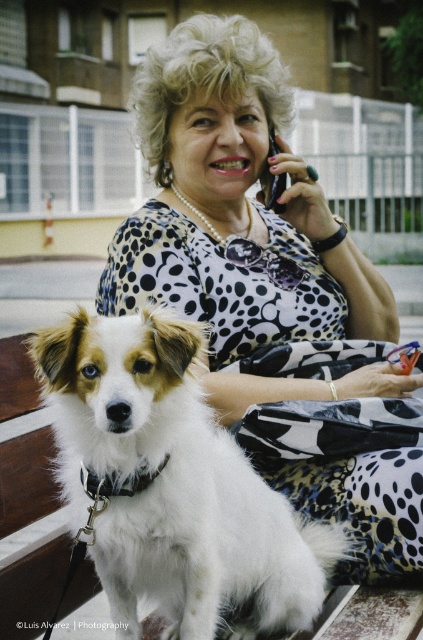
You are a photographer adjusting your camera settings to focus on two specific points in the scene. The first point is point [335,300] and the second is point [153,545]. Which point should you focus on first if you want to ensure the closest object is in sharp focus?

Point [335,300] is further to the camera than point [153,545], so you should focus on point [335,300] first to capture the closest object in sharp focus.